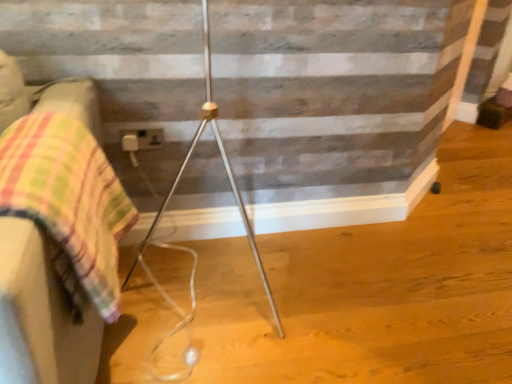
What do you see at coordinates (40, 315) in the screenshot? I see `multicolored fabric at left` at bounding box center [40, 315].

At what (x,y) coordinates should I click in order to perform the action: click on multicolored fabric at left. Please return your answer as a coordinate pair (x, y). This screenshot has height=384, width=512. Looking at the image, I should click on (40, 315).

I want to click on multicolored fabric at left, so point(40,315).